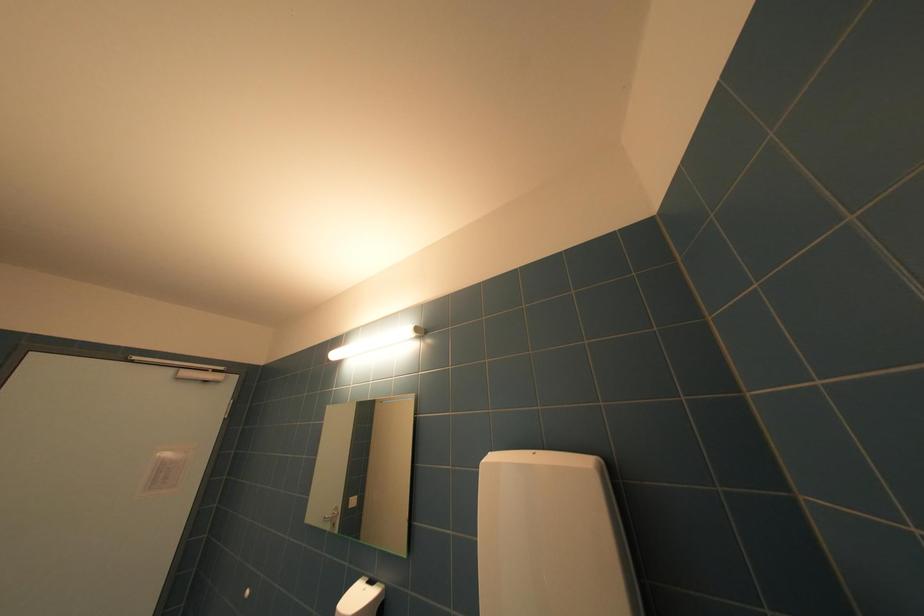
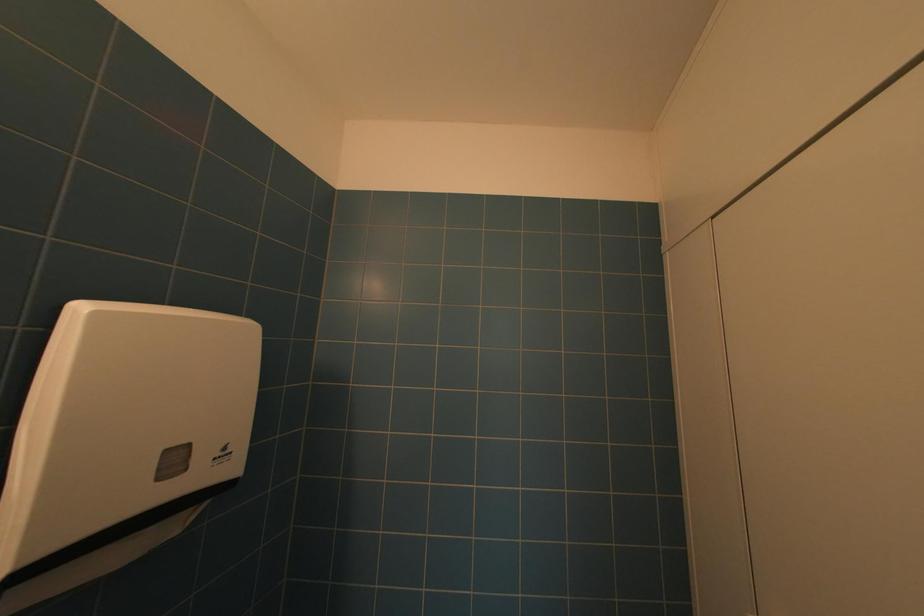
First-person continuous shooting, in which direction is the camera rotating?

The rotation direction of the camera is right-up.